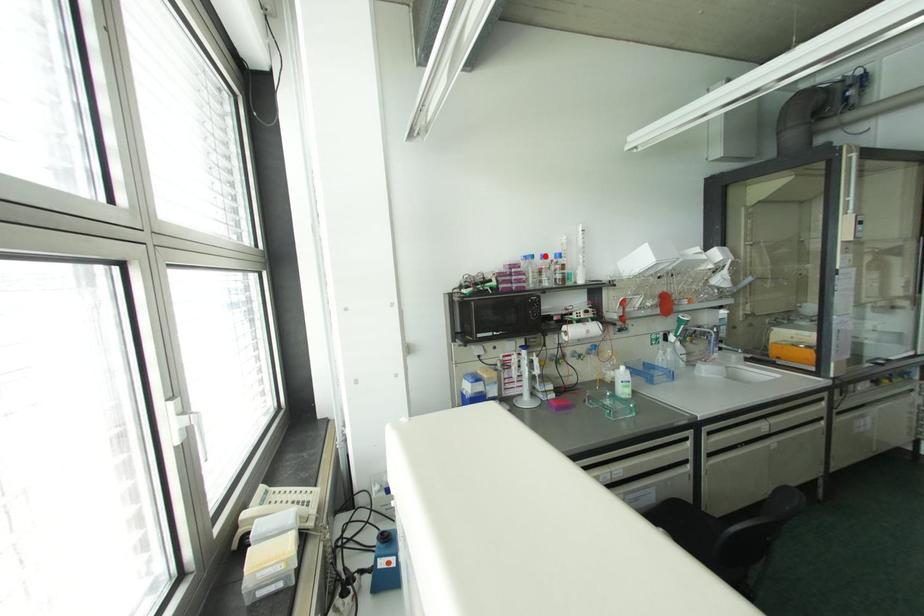
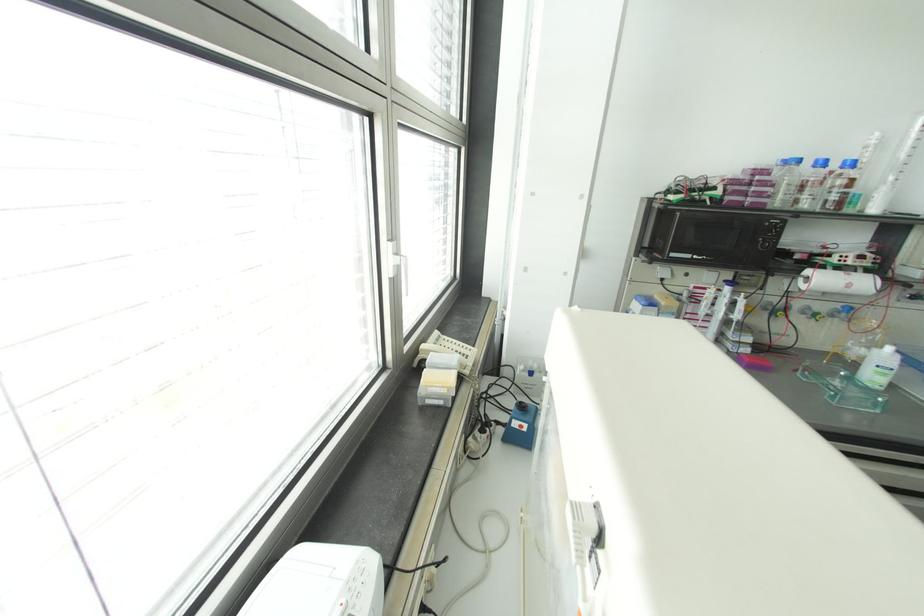
Question: I am providing you with two images of the same scene from different viewpoints. A red point is shown in image1. For the corresponding object point in image2, is it positioned nearer or farther from the camera?

Choices:
 (A) Nearer
 (B) Farther

Answer: (B)